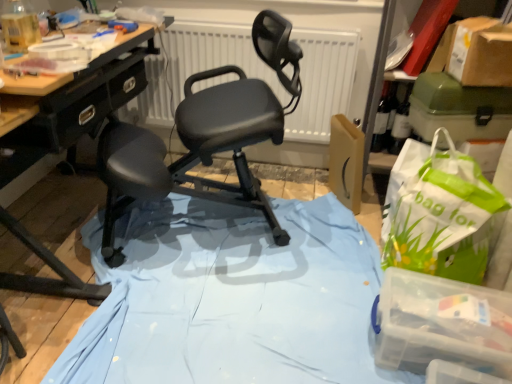
Question: Is white matte radiator at center positioned far away from matte black chair at center?

Choices:
 (A) yes
 (B) no

Answer: (B)

Question: Is white matte radiator at center shorter than matte black chair at center?

Choices:
 (A) no
 (B) yes

Answer: (B)

Question: Is the depth of white matte radiator at center less than that of matte black chair at center?

Choices:
 (A) no
 (B) yes

Answer: (A)

Question: Does white matte radiator at center have a greater height compared to matte black chair at center?

Choices:
 (A) no
 (B) yes

Answer: (A)

Question: Can you confirm if white matte radiator at center is thinner than matte black chair at center?

Choices:
 (A) no
 (B) yes

Answer: (B)

Question: From a real-world perspective, is white matte radiator at center physically below matte black chair at center?

Choices:
 (A) no
 (B) yes

Answer: (A)

Question: From a real-world perspective, is transparent plastic container at lower right, acting as the first box starting from the front, beneath white matte radiator at center?

Choices:
 (A) no
 (B) yes

Answer: (B)

Question: From the image's perspective, is transparent plastic container at lower right, the first box ordered from the bottom, below white matte radiator at center?

Choices:
 (A) no
 (B) yes

Answer: (B)

Question: From the image's perspective, is transparent plastic container at lower right, which is counted as the 2th box, starting from the top, above white matte radiator at center?

Choices:
 (A) yes
 (B) no

Answer: (B)

Question: Can you confirm if transparent plastic container at lower right, acting as the first box starting from the front, is positioned to the left of white matte radiator at center?

Choices:
 (A) yes
 (B) no

Answer: (B)

Question: Is transparent plastic container at lower right, which is counted as the 2th box, starting from the top, smaller than white matte radiator at center?

Choices:
 (A) no
 (B) yes

Answer: (B)

Question: Does transparent plastic container at lower right, which is counted as the 2th box, starting from the top, have a lesser height compared to white matte radiator at center?

Choices:
 (A) no
 (B) yes

Answer: (B)

Question: Does green plastic box at upper right, which is the second box in front-to-back order, have a greater width compared to transparent plastic container at lower right, which is counted as the 2th box, starting from the top?

Choices:
 (A) yes
 (B) no

Answer: (B)